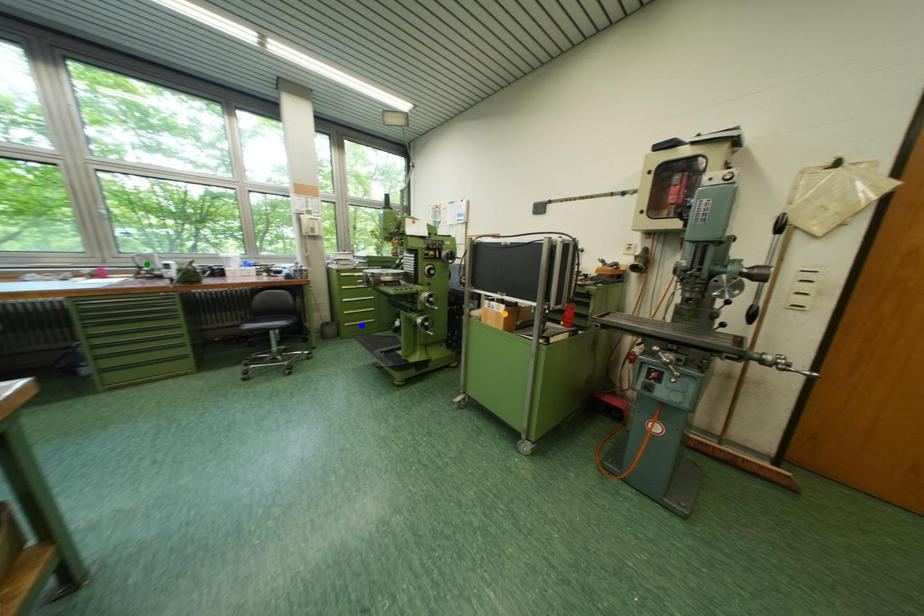
Order these from nearest to farthest:
A) orange point
B) green point
C) blue point

orange point
green point
blue point